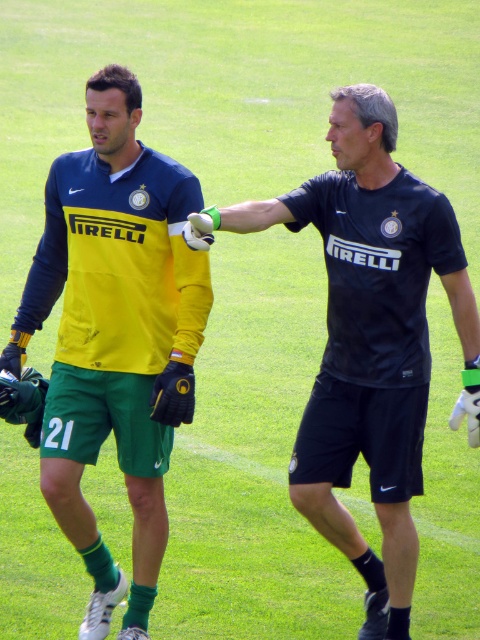
Which of these two, yellow matte jersey at left or black matte shirt at center, stands taller?

Standing taller between the two is yellow matte jersey at left.

Who is shorter, yellow matte jersey at left or black matte shirt at center?

With less height is black matte shirt at center.

Find the location of `yellow matte jersey at left`. yellow matte jersey at left is located at coordinates (115, 337).